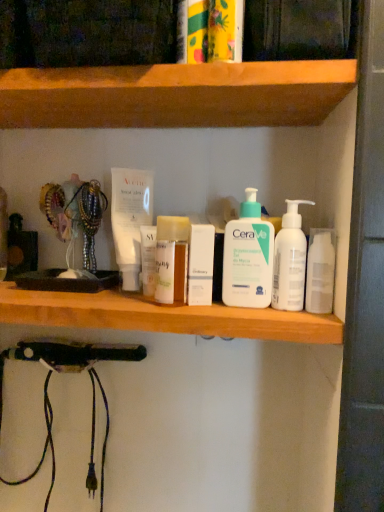
Question: Would you say white glossy mouthwash at right is a long distance from white matte pump bottle at center, which is the 1th cleaning product in left-to-right order?

Choices:
 (A) yes
 (B) no

Answer: (B)

Question: Does white glossy mouthwash at right have a greater height compared to white matte pump bottle at center, which is the 1th cleaning product in left-to-right order?

Choices:
 (A) yes
 (B) no

Answer: (B)

Question: From the image's perspective, is white glossy mouthwash at right above white matte pump bottle at center, which is the second cleaning product from right to left?

Choices:
 (A) yes
 (B) no

Answer: (B)

Question: Is white glossy mouthwash at right shorter than white matte pump bottle at center, which is the second cleaning product from right to left?

Choices:
 (A) no
 (B) yes

Answer: (B)

Question: Could white matte pump bottle at center, which is the 1th cleaning product in left-to-right order, be considered to be inside white glossy mouthwash at right?

Choices:
 (A) no
 (B) yes

Answer: (A)

Question: Is white plastic bottles at center, marked as the 1th shelf in a bottom-to-top arrangement, wider or thinner than white pump bottle at center, which is counted as the 2th cleaning product, starting from the left?

Choices:
 (A) wide
 (B) thin

Answer: (A)

Question: Visually, is white plastic bottles at center, arranged as the second shelf when viewed from the top, positioned to the left or to the right of white pump bottle at center, which is the first cleaning product in right-to-left order?

Choices:
 (A) left
 (B) right

Answer: (A)

Question: Considering the positions of white plastic bottles at center, marked as the 1th shelf in a bottom-to-top arrangement, and white pump bottle at center, which is the first cleaning product in right-to-left order, in the image, is white plastic bottles at center, marked as the 1th shelf in a bottom-to-top arrangement, taller or shorter than white pump bottle at center, which is the first cleaning product in right-to-left order,?

Choices:
 (A) tall
 (B) short

Answer: (B)

Question: Does point (210, 316) appear closer or farther from the camera than point (276, 237)?

Choices:
 (A) closer
 (B) farther

Answer: (A)

Question: In the image, is white glossy mouthwash at right positioned in front of or behind wooden at upper center, the first shelf positioned from the top?

Choices:
 (A) behind
 (B) front

Answer: (A)

Question: From the image's perspective, is white glossy mouthwash at right located above or below wooden at upper center, the second shelf in the bottom-to-top sequence?

Choices:
 (A) above
 (B) below

Answer: (B)

Question: From their relative heights in the image, would you say white glossy mouthwash at right is taller or shorter than wooden at upper center, the first shelf positioned from the top?

Choices:
 (A) tall
 (B) short

Answer: (A)

Question: In the image, is white glossy mouthwash at right on the left side or the right side of wooden at upper center, the first shelf positioned from the top?

Choices:
 (A) left
 (B) right

Answer: (B)

Question: Considering the relative positions of white matte pump bottle at center, which is the second cleaning product from right to left, and white glossy mouthwash at right in the image provided, is white matte pump bottle at center, which is the second cleaning product from right to left, to the left or to the right of white glossy mouthwash at right?

Choices:
 (A) right
 (B) left

Answer: (B)

Question: Is white matte pump bottle at center, which is the second cleaning product from right to left, taller or shorter than white glossy mouthwash at right?

Choices:
 (A) short
 (B) tall

Answer: (B)